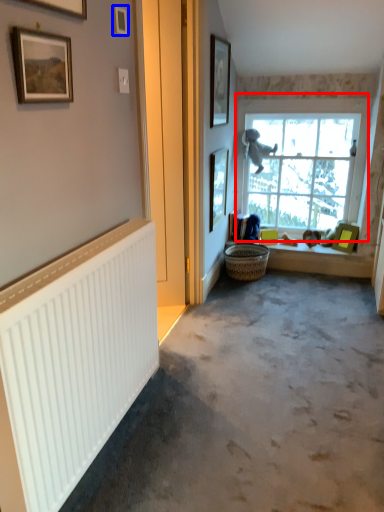
Question: Which of the following is the farthest to the observer, window (highlighted by a red box) or picture frame (highlighted by a blue box)?

Choices:
 (A) window
 (B) picture frame

Answer: (A)